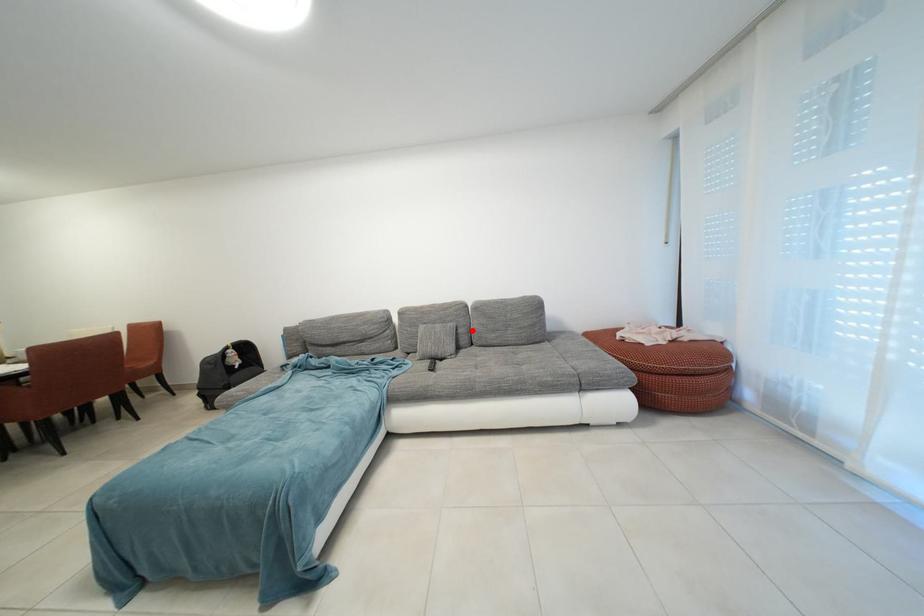
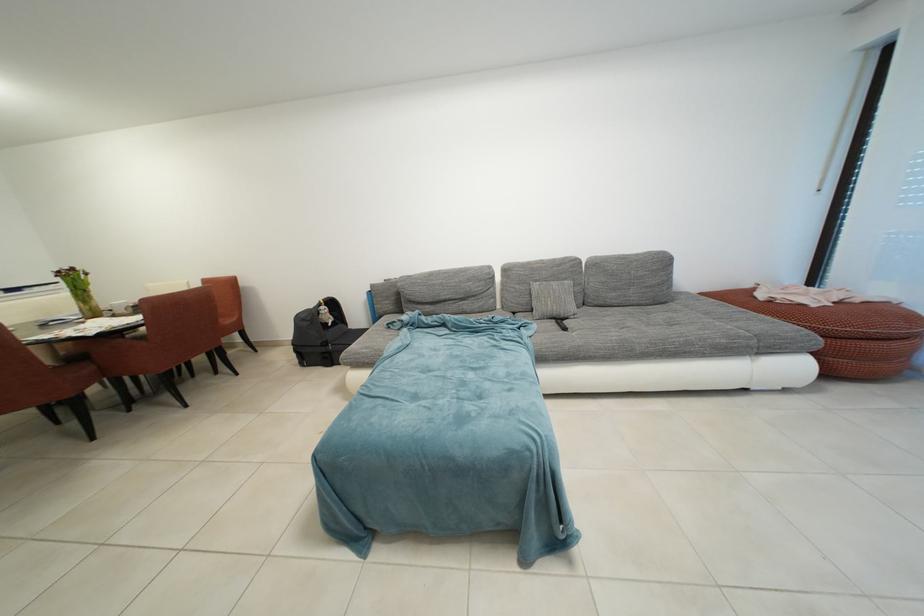
Where in the second image is the point corresponding to the highlighted location from the first image?

(588, 289)